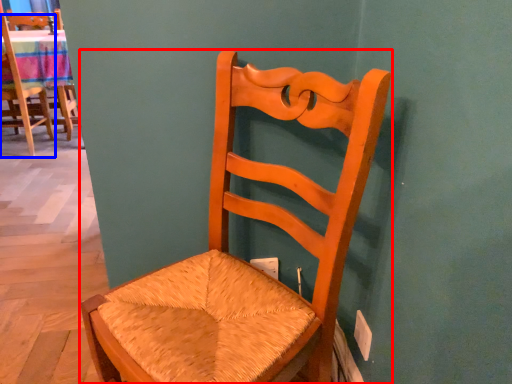
Question: Which object is closer to the camera taking this photo, chair (highlighted by a red box) or chair (highlighted by a blue box)?

Choices:
 (A) chair
 (B) chair

Answer: (A)